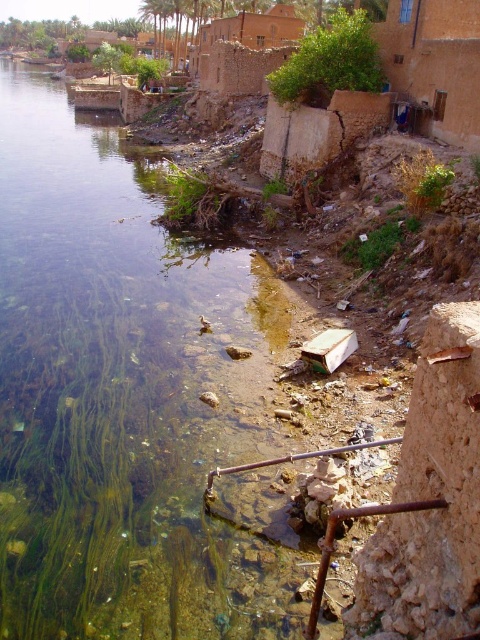
Who is more forward, (73,483) or (322,100)?

Point (73,483) is more forward.

Which is behind, point (43, 200) or point (317, 86)?

Positioned behind is point (43, 200).

I want to click on clear water at river left, so click(120, 397).